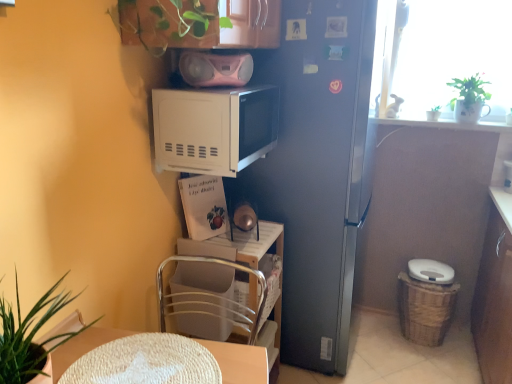
Question: Is woven brown basket at lower right closer to camera compared to satin silver refrigerator at center?

Choices:
 (A) yes
 (B) no

Answer: (B)

Question: Can you confirm if woven brown basket at lower right is taller than satin silver refrigerator at center?

Choices:
 (A) no
 (B) yes

Answer: (A)

Question: From a real-world perspective, is woven brown basket at lower right positioned under satin silver refrigerator at center based on gravity?

Choices:
 (A) no
 (B) yes

Answer: (B)

Question: From the image's perspective, is woven brown basket at lower right below satin silver refrigerator at center?

Choices:
 (A) no
 (B) yes

Answer: (B)

Question: Would you consider woven brown basket at lower right to be distant from satin silver refrigerator at center?

Choices:
 (A) yes
 (B) no

Answer: (B)

Question: Does woven brown basket at lower right have a larger size compared to satin silver refrigerator at center?

Choices:
 (A) yes
 (B) no

Answer: (B)

Question: Is green leafy plant at lower left, placed as the first houseplant when sorted from left to right, far from white plastic chair at lower center?

Choices:
 (A) no
 (B) yes

Answer: (A)

Question: Is green leafy plant at lower left, which is counted as the third houseplant, starting from the back, outside white plastic chair at lower center?

Choices:
 (A) yes
 (B) no

Answer: (A)

Question: From the image's perspective, is green leafy plant at lower left, which is the first houseplant from bottom to top, below white plastic chair at lower center?

Choices:
 (A) no
 (B) yes

Answer: (A)

Question: Can you confirm if green leafy plant at lower left, the 3th houseplant viewed from the top, is bigger than white plastic chair at lower center?

Choices:
 (A) no
 (B) yes

Answer: (B)

Question: Does green leafy plant at lower left, which appears as the 1th houseplant when viewed from the front, have a greater height compared to white plastic chair at lower center?

Choices:
 (A) no
 (B) yes

Answer: (A)

Question: Is green leafy plant at lower left, which is the first houseplant from bottom to top, behind white plastic chair at lower center?

Choices:
 (A) yes
 (B) no

Answer: (B)

Question: Is white glossy pot at upper right, the third houseplant from the front, thinner than white plastic chair at lower center?

Choices:
 (A) yes
 (B) no

Answer: (A)